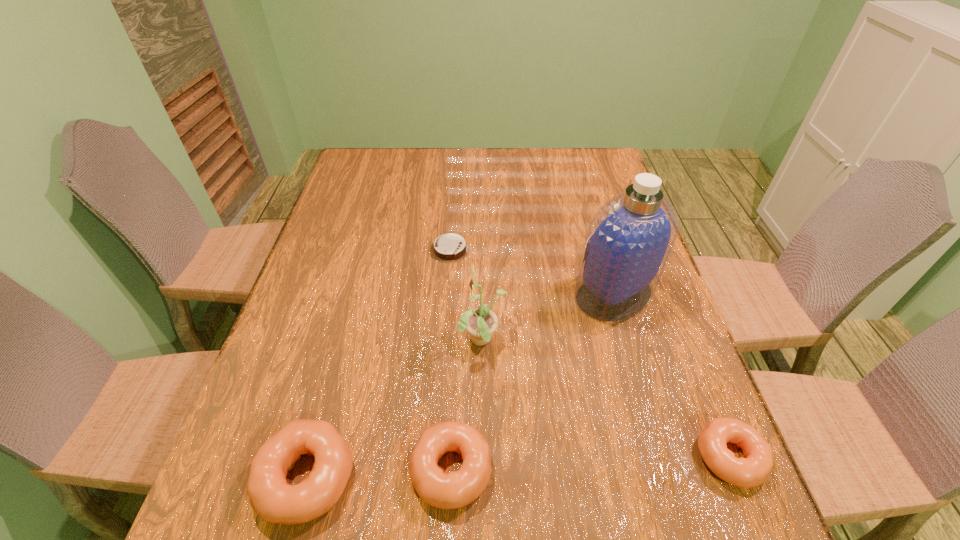
Locate an element on the screen. vacant space situated on the right of the second shortest doughnut is located at coordinates (551, 470).

Locate an element on the screen. Image resolution: width=960 pixels, height=540 pixels. vacant area situated on the left of the shortest doughnut is located at coordinates (649, 457).

The image size is (960, 540). I want to click on free space located on the left of the shortest object, so click(x=340, y=250).

The width and height of the screenshot is (960, 540). I want to click on free space located on the front-facing side of the sunflower, so click(412, 342).

Where is `free space located on the front-facing side of the sunflower`? This screenshot has width=960, height=540. free space located on the front-facing side of the sunflower is located at coordinates (289, 342).

Locate an element on the screen. vacant space located on the front-facing side of the sunflower is located at coordinates (424, 342).

Locate an element on the screen. free space located on the left of the cleansing agent is located at coordinates (528, 294).

Find the location of `object located in the left edge section of the desktop`. object located in the left edge section of the desktop is located at coordinates (271, 497).

In order to click on doughnut at the right edge in this screenshot , I will do `click(751, 471)`.

Find the location of a particular element. The width and height of the screenshot is (960, 540). cleansing agent that is at the right edge is located at coordinates click(x=629, y=240).